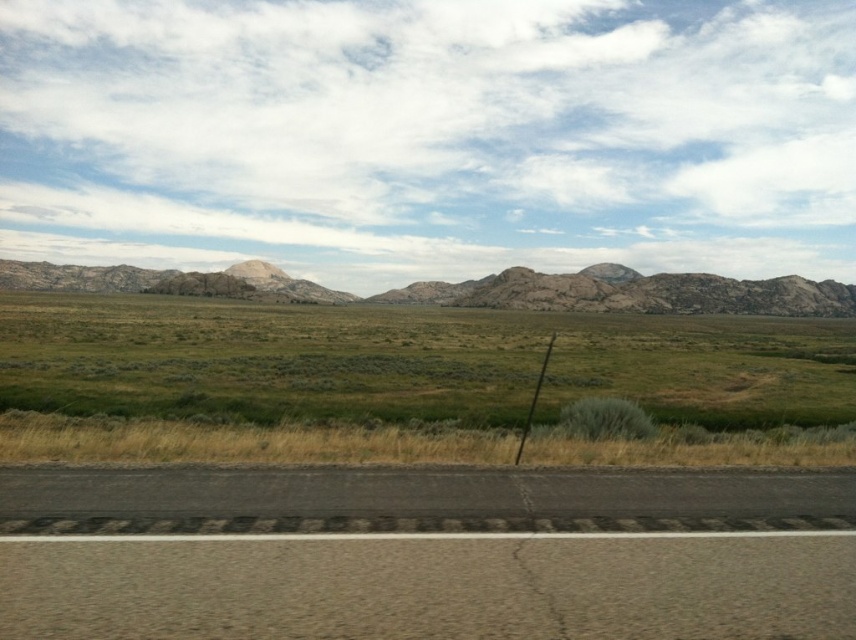
Question: Does black asphalt road at lower center appear over rugged stone mountain range at center?

Choices:
 (A) no
 (B) yes

Answer: (A)

Question: Does black asphalt road at lower center appear on the right side of rugged stone mountain range at center?

Choices:
 (A) yes
 (B) no

Answer: (A)

Question: Which object appears closest to the camera in this image?

Choices:
 (A) black asphalt road at lower center
 (B) green grassland at center
 (C) rugged stone mountain range at center

Answer: (A)

Question: Based on their relative distances, which object is farther from the rugged stone mountain range at center?

Choices:
 (A) black asphalt road at lower center
 (B) green grassland at center

Answer: (A)

Question: Is green grassland at center further to the viewer compared to rugged stone mountain range at center?

Choices:
 (A) no
 (B) yes

Answer: (A)

Question: Among these objects, which one is nearest to the camera?

Choices:
 (A) green grassland at center
 (B) rugged stone mountain range at center
 (C) black asphalt road at lower center

Answer: (C)